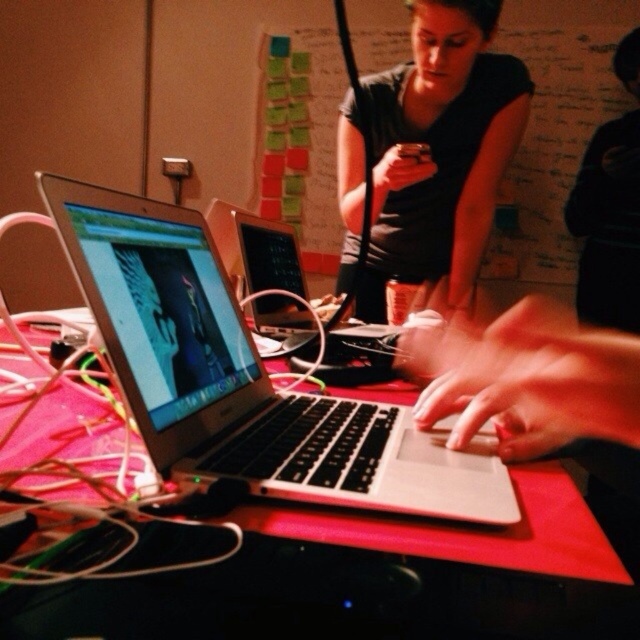
You are a delivery robot navigating a workspace. You need to deliver a package to the point at coordinates point at (x=113, y=301). There is an obstacle at point at (x=428, y=204). Will you be able to reach the delivery point without going through the obstacle?

Point at (x=113, y=301) is in front of point at (x=428, y=204), so the delivery robot can reach the delivery point without going through the obstacle.

You are organizing a photo shoot and need to ensure proper lighting for two key elements in the scene. The smooth skin hands at center and the black fabric shirt at upper center must be well illuminated. Based on their positions, which element is closer to the camera and would require more direct lighting?

The smooth skin hands at center is located below the black fabric shirt at upper center, so the hands are closer to the camera. Therefore, the smooth skin hands at center would require more direct lighting to ensure proper illumination compared to the black fabric shirt at upper center.